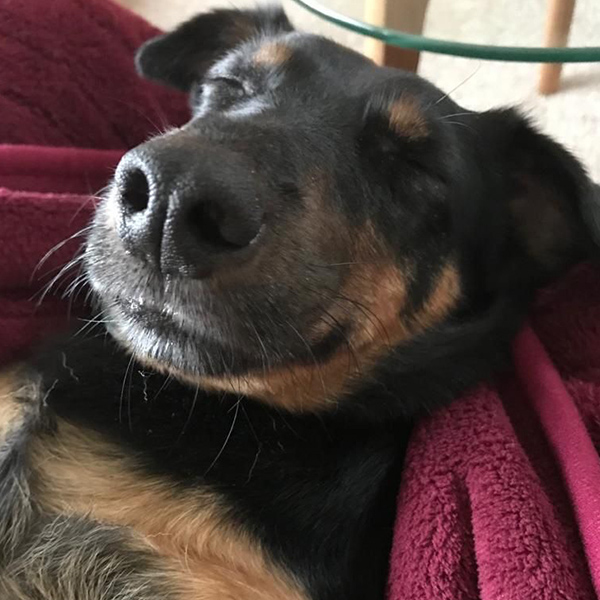
Find the location of a particular element. The height and width of the screenshot is (600, 600). towel is located at coordinates (502, 517).